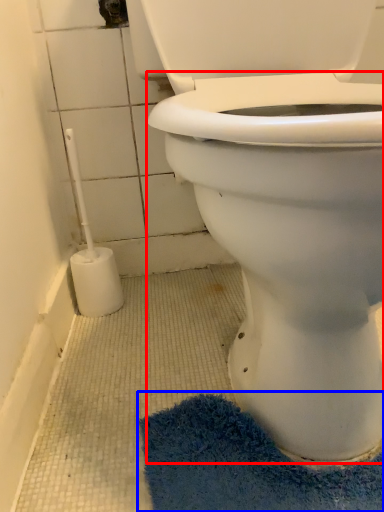
Question: Among these objects, which one is nearest to the camera, bidet (highlighted by a red box) or bath mat (highlighted by a blue box)?

Choices:
 (A) bidet
 (B) bath mat

Answer: (A)